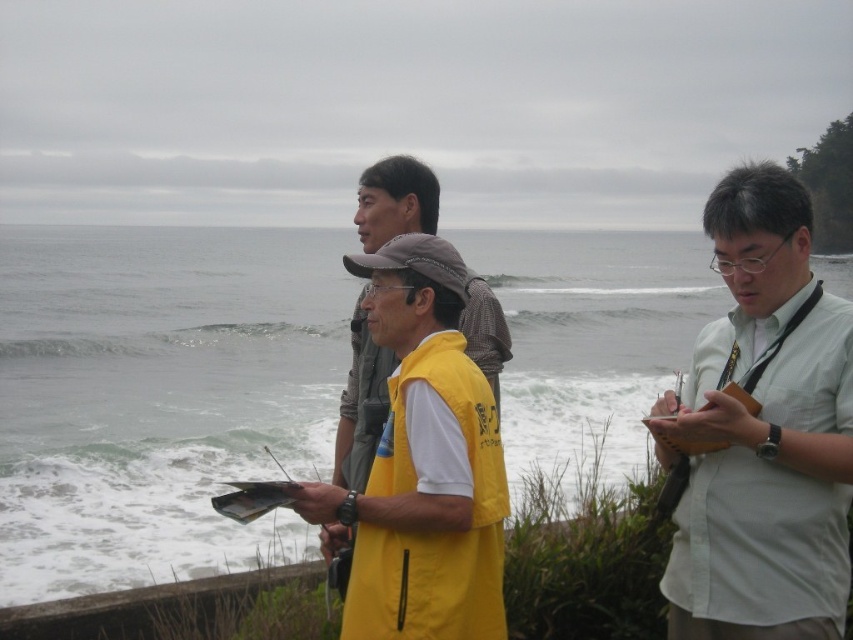
How distant is white frothy water at center from yellow matte vest at center?

white frothy water at center is 33.10 meters from yellow matte vest at center.

Is white frothy water at center closer to the viewer compared to yellow matte vest at center?

No, white frothy water at center is further to the viewer.

Locate an element on the screen. The width and height of the screenshot is (853, 640). white frothy water at center is located at coordinates (160, 396).

Who is more forward, (697, 390) or (431, 483)?

Point (431, 483) is more forward.

You are a GUI agent. You are given a task and a screenshot of the screen. Output one action in this format:
    pyautogui.click(x=<x>, y=<y>)
    Task: Click on the white shirt at right
    The width and height of the screenshot is (853, 640).
    Given the screenshot: What is the action you would take?
    pyautogui.click(x=762, y=433)

Where is `white shirt at right`? Image resolution: width=853 pixels, height=640 pixels. white shirt at right is located at coordinates (762, 433).

Looking at this image, does white frothy water at center appear over white shirt at right?

Indeed, white frothy water at center is positioned over white shirt at right.

Is white frothy water at center below white shirt at right?

Actually, white frothy water at center is above white shirt at right.

In order to click on white frothy water at center in this screenshot , I will do `click(160, 396)`.

This screenshot has height=640, width=853. Find the location of `white frothy water at center`. white frothy water at center is located at coordinates (160, 396).